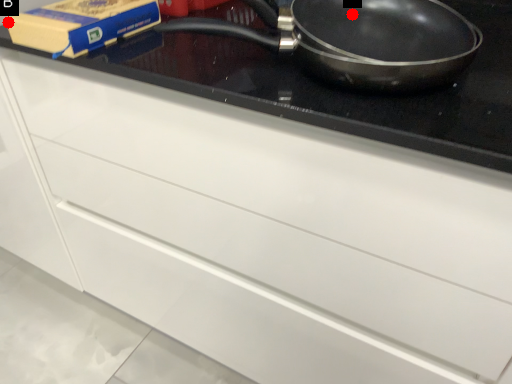
Question: Two points are circled on the image, labeled by A and B beside each circle. Which point is farther from the camera taking this photo?

Choices:
 (A) A is further
 (B) B is further

Answer: (B)